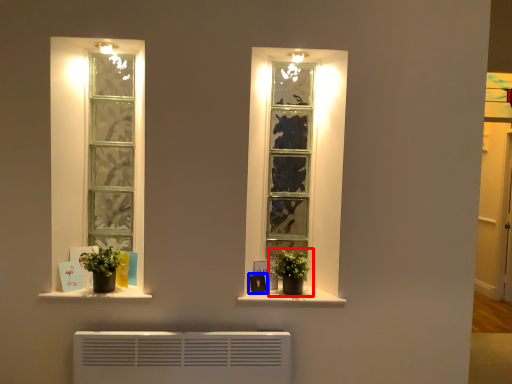
Question: Which point is further to the camera, houseplant (highlighted by a red box) or picture frame (highlighted by a blue box)?

Choices:
 (A) houseplant
 (B) picture frame

Answer: (B)